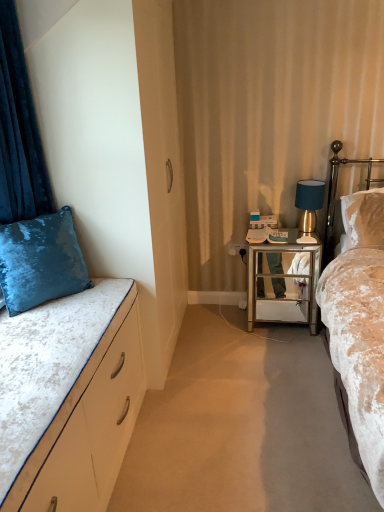
Question: Considering the positions of point (21, 242) and point (228, 247), is point (21, 242) closer or farther from the camera than point (228, 247)?

Choices:
 (A) closer
 (B) farther

Answer: (A)

Question: From their relative heights in the image, would you say velvet blue pillow at left is taller or shorter than white glossy power outlet at center?

Choices:
 (A) tall
 (B) short

Answer: (A)

Question: Which is farther from the white glossy power outlet at center?

Choices:
 (A) velvet beige bed at right, which appears as the 1th bed when viewed from the right
 (B) gold mirrored nightstand at right
 (C) gold metallic headboard at right
 (D) velvet white bed at left, the first bed viewed from the left
 (E) velvet blue curtain at left

Answer: (D)

Question: Considering the real-world distances, which object is closest to the gold metallic headboard at right?

Choices:
 (A) gold mirrored nightstand at right
 (B) velvet white bed at left, the first bed viewed from the left
 (C) white glossy power outlet at center
 (D) velvet beige bed at right, which appears as the 1th bed when viewed from the right
 (E) velvet blue curtain at left

Answer: (A)